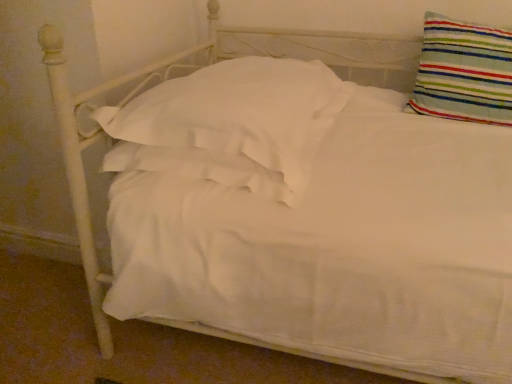
Question: Is striped fabric pillow at upper right, acting as the 2th pillow starting from the left, closer to the viewer compared to white soft pillow at center, marked as the 2th pillow in a right-to-left arrangement?

Choices:
 (A) yes
 (B) no

Answer: (B)

Question: Does striped fabric pillow at upper right, the first pillow viewed from the right, appear on the right side of white soft pillow at center, marked as the 2th pillow in a right-to-left arrangement?

Choices:
 (A) yes
 (B) no

Answer: (A)

Question: Can we say striped fabric pillow at upper right, acting as the 2th pillow starting from the left, lies outside white soft pillow at center, marked as the 2th pillow in a right-to-left arrangement?

Choices:
 (A) no
 (B) yes

Answer: (B)

Question: From the image's perspective, is striped fabric pillow at upper right, acting as the 2th pillow starting from the left, on top of white soft pillow at center, the 1th pillow when ordered from left to right?

Choices:
 (A) no
 (B) yes

Answer: (B)

Question: Is white soft pillow at center, marked as the 2th pillow in a right-to-left arrangement, at the back of striped fabric pillow at upper right, the first pillow viewed from the right?

Choices:
 (A) yes
 (B) no

Answer: (B)

Question: Can you confirm if striped fabric pillow at upper right, acting as the 2th pillow starting from the left, is positioned to the left of white soft pillow at center, the 1th pillow when ordered from left to right?

Choices:
 (A) no
 (B) yes

Answer: (A)

Question: Considering the relative sizes of white soft pillow at center, marked as the 2th pillow in a right-to-left arrangement, and striped fabric pillow at upper right, acting as the 2th pillow starting from the left, in the image provided, is white soft pillow at center, marked as the 2th pillow in a right-to-left arrangement, taller than striped fabric pillow at upper right, acting as the 2th pillow starting from the left,?

Choices:
 (A) yes
 (B) no

Answer: (B)

Question: Is white soft pillow at center, the 1th pillow when ordered from left to right, behind striped fabric pillow at upper right, the first pillow viewed from the right?

Choices:
 (A) yes
 (B) no

Answer: (B)

Question: Is white soft pillow at center, marked as the 2th pillow in a right-to-left arrangement, thinner than striped fabric pillow at upper right, the first pillow viewed from the right?

Choices:
 (A) no
 (B) yes

Answer: (A)

Question: From a real-world perspective, is white soft pillow at center, the 1th pillow when ordered from left to right, physically above striped fabric pillow at upper right, acting as the 2th pillow starting from the left?

Choices:
 (A) yes
 (B) no

Answer: (B)

Question: Is white soft pillow at center, the 1th pillow when ordered from left to right, outside of striped fabric pillow at upper right, acting as the 2th pillow starting from the left?

Choices:
 (A) no
 (B) yes

Answer: (B)

Question: From a real-world perspective, is white soft pillow at center, marked as the 2th pillow in a right-to-left arrangement, positioned under striped fabric pillow at upper right, acting as the 2th pillow starting from the left, based on gravity?

Choices:
 (A) no
 (B) yes

Answer: (B)

Question: Considering the positions of striped fabric pillow at upper right, the first pillow viewed from the right, and white soft pillow at center, the 1th pillow when ordered from left to right, in the image, is striped fabric pillow at upper right, the first pillow viewed from the right, bigger or smaller than white soft pillow at center, the 1th pillow when ordered from left to right,?

Choices:
 (A) small
 (B) big

Answer: (A)